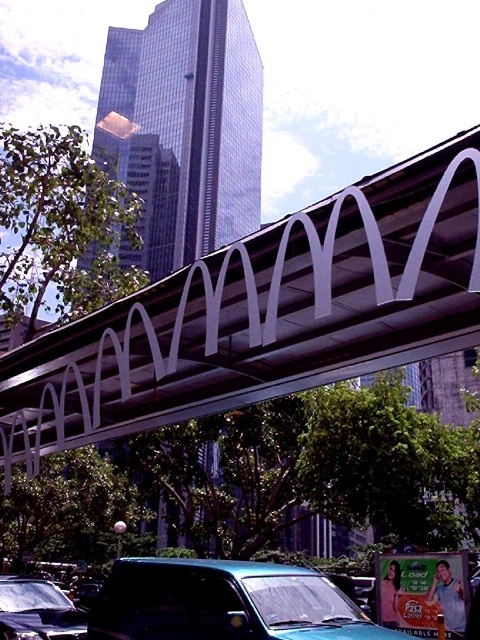
You are standing at the center of the image and want to cross the street. The metallic silver pedestrian bridge at center is your only option. Is the bridge directly in front of you, or do you need to move left or right to reach it?

The metallic silver pedestrian bridge at center is located at point (264, 314), which is very close to the center coordinates. Therefore, it is directly in front of you, so you don,t need to move left or right to reach it.

You are driving a teal matte van at lower center and want to go under the metallic silver pedestrian bridge at center. Is there enough clearance for your van to pass through?

The metallic silver pedestrian bridge at center is positioned over the teal matte van at lower center, which means there is sufficient clearance for the van to pass underneath safely.

You are a delivery driver who needs to park your vehicle in this area. You see the teal matte van at lower center and the shiny black car at lower left. Which vehicle is positioned higher relative to the other?

The teal matte van at lower center is above the shiny black car at lower left, so it is positioned higher.